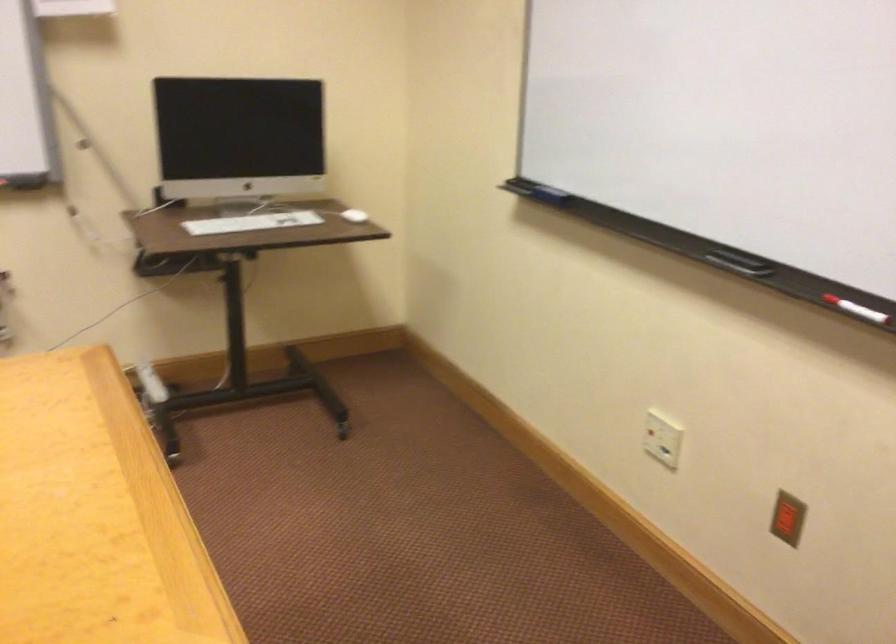
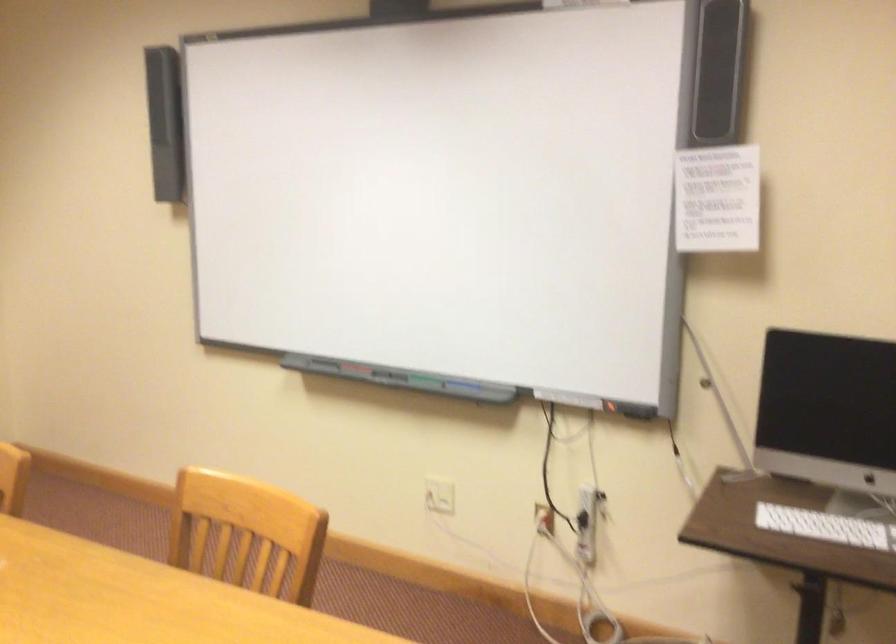
Question: How did the camera likely rotate?

Choices:
 (A) Left
 (B) Right
 (C) Up
 (D) Down

Answer: (A)